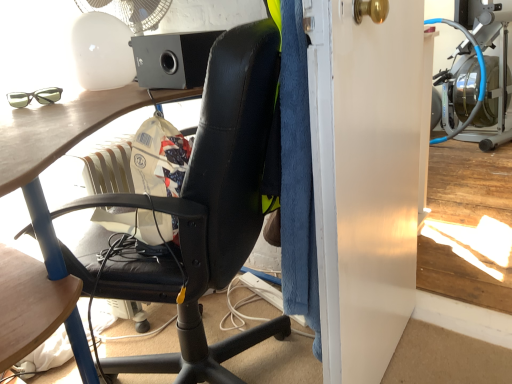
This screenshot has width=512, height=384. What do you see at coordinates (370, 186) in the screenshot?
I see `white glossy screen door at right` at bounding box center [370, 186].

What is the approximate height of white plastic mechanical fan at upper left?

It is 9.14 inches.

Where is `matte black glasses at upper left`? matte black glasses at upper left is located at coordinates (35, 97).

Locate an element on the screen. The width and height of the screenshot is (512, 384). black matte speaker at upper center is located at coordinates (172, 59).

What do you see at coordinates (216, 202) in the screenshot? I see `black leather chair at center` at bounding box center [216, 202].

Where is `white glossy screen door at right`? This screenshot has width=512, height=384. white glossy screen door at right is located at coordinates (370, 186).

Are black matte speaker at upper center and white plastic mechanical fan at upper left far apart?

No, black matte speaker at upper center is not far from white plastic mechanical fan at upper left.

Consider the image. Considering the sizes of objects black matte speaker at upper center and white plastic mechanical fan at upper left in the image provided, who is wider, black matte speaker at upper center or white plastic mechanical fan at upper left?

black matte speaker at upper center is wider.

Can you confirm if black matte speaker at upper center is smaller than white plastic mechanical fan at upper left?

Indeed, black matte speaker at upper center has a smaller size compared to white plastic mechanical fan at upper left.

Does point (175, 42) lie behind point (170, 2)?

No, it is in front of (170, 2).

Which of these two, white glossy screen door at right or black leather chair at center, stands shorter?

Standing shorter between the two is black leather chair at center.

Is white glossy screen door at right facing towards black leather chair at center?

No, white glossy screen door at right is not facing towards black leather chair at center.

Looking at this image, is white glossy screen door at right in front of black leather chair at center?

No.

Is point (358, 70) positioned in front of point (218, 205)?

Yes, it is in front of point (218, 205).

How different are the orientations of black matte speaker at upper center and black leather chair at center in degrees?

69.8 degrees.

Who is more distant, black matte speaker at upper center or black leather chair at center?

black matte speaker at upper center is more distant.

Which is closer to the camera, (x=170, y=77) or (x=220, y=149)?

The point (x=220, y=149) is in front.

Considering the relative positions of black matte speaker at upper center and white glossy screen door at right in the image provided, is black matte speaker at upper center in front of white glossy screen door at right?

No.

Is black matte speaker at upper center taller or shorter than white glossy screen door at right?

Considering their sizes, black matte speaker at upper center has less height than white glossy screen door at right.

Can you see black matte speaker at upper center touching white glossy screen door at right?

black matte speaker at upper center is not next to white glossy screen door at right, and they're not touching.

From the image's perspective, which is below, black matte speaker at upper center or white glossy screen door at right?

white glossy screen door at right.

How different are the orientations of matte black glasses at upper left and white plastic mechanical fan at upper left in degrees?

matte black glasses at upper left and white plastic mechanical fan at upper left are facing 91.2 degrees away from each other.

Considering the relative sizes of matte black glasses at upper left and white plastic mechanical fan at upper left in the image provided, is matte black glasses at upper left smaller than white plastic mechanical fan at upper left?

Indeed, matte black glasses at upper left has a smaller size compared to white plastic mechanical fan at upper left.

Considering the sizes of objects matte black glasses at upper left and white plastic mechanical fan at upper left in the image provided, who is wider, matte black glasses at upper left or white plastic mechanical fan at upper left?

With larger width is white plastic mechanical fan at upper left.

Considering the positions of objects matte black glasses at upper left and white plastic mechanical fan at upper left in the image provided, who is more to the left, matte black glasses at upper left or white plastic mechanical fan at upper left?

Positioned to the left is matte black glasses at upper left.

Is white plastic mechanical fan at upper left at the right side of matte black glasses at upper left?

Yes.

From a real-world perspective, is white plastic mechanical fan at upper left beneath matte black glasses at upper left?

Actually, white plastic mechanical fan at upper left is physically above matte black glasses at upper left in the real world.

Where is `mechanical fan above the matte black glasses at upper left (from a real-world perspective)`? This screenshot has width=512, height=384. mechanical fan above the matte black glasses at upper left (from a real-world perspective) is located at coordinates (130, 12).

Would you say white plastic mechanical fan at upper left is inside or outside black leather chair at center?

white plastic mechanical fan at upper left is located beyond the bounds of black leather chair at center.

In terms of size, does white plastic mechanical fan at upper left appear bigger or smaller than black leather chair at center?

Considering their sizes, white plastic mechanical fan at upper left takes up less space than black leather chair at center.

Considering the positions of objects white plastic mechanical fan at upper left and black leather chair at center in the image provided, who is more to the left, white plastic mechanical fan at upper left or black leather chair at center?

From the viewer's perspective, white plastic mechanical fan at upper left appears more on the left side.

From the image's perspective, is white plastic mechanical fan at upper left positioned above or below black leather chair at center?

white plastic mechanical fan at upper left is situated higher than black leather chair at center in the image.

The width and height of the screenshot is (512, 384). Identify the location of mechanical fan behind the black matte speaker at upper center. (130, 12).

Find the location of a particular element. chair below the white glossy screen door at right (from the image's perspective) is located at coordinates (216, 202).

When comparing their distances from black leather chair at center, does white plastic mechanical fan at upper left or black matte speaker at upper center seem further?

Among the two, white plastic mechanical fan at upper left is located further to black leather chair at center.

From the image, which object appears to be nearer to white glossy screen door at right, white plastic mechanical fan at upper left or black matte speaker at upper center?

Result: black matte speaker at upper center is positioned closer to the anchor white glossy screen door at right.

Considering their positions, is white glossy screen door at right positioned further to matte black glasses at upper left than black leather chair at center?

The object further to matte black glasses at upper left is white glossy screen door at right.

Estimate the real-world distances between objects in this image. Which object is closer to white plastic mechanical fan at upper left, black matte speaker at upper center or black leather chair at center?

The object closer to white plastic mechanical fan at upper left is black matte speaker at upper center.

Looking at the image, which one is located closer to white plastic mechanical fan at upper left, white glossy screen door at right or black matte speaker at upper center?

Based on the image, black matte speaker at upper center appears to be nearer to white plastic mechanical fan at upper left.

From the image, which object appears to be farther from black matte speaker at upper center, white plastic mechanical fan at upper left or white glossy screen door at right?

Based on the image, white glossy screen door at right appears to be further to black matte speaker at upper center.

Which object lies nearer to the anchor point black leather chair at center, black matte speaker at upper center or white plastic mechanical fan at upper left?

The object closer to black leather chair at center is black matte speaker at upper center.

Estimate the real-world distances between objects in this image. Which object is further from black leather chair at center, white plastic mechanical fan at upper left or white glossy screen door at right?

white plastic mechanical fan at upper left is further to black leather chair at center.

I want to click on chair situated between matte black glasses at upper left and white glossy screen door at right from left to right, so click(x=216, y=202).

Find the location of a particular element. This screenshot has height=384, width=512. loudspeaker located between black leather chair at center and white plastic mechanical fan at upper left in the depth direction is located at coordinates (172, 59).

The height and width of the screenshot is (384, 512). I want to click on mechanical fan located between matte black glasses at upper left and black matte speaker at upper center in the left-right direction, so click(x=130, y=12).

Identify the location of screen door between black leather chair at center and black matte speaker at upper center in the front-back direction. This screenshot has width=512, height=384. (370, 186).